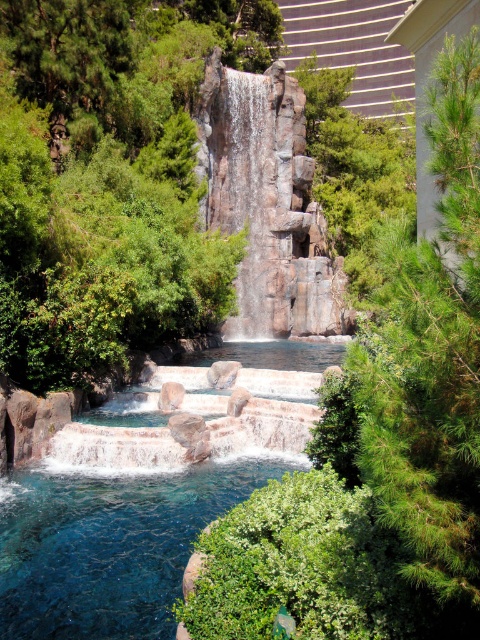
Consider the image. Who is more forward, (477, 228) or (143, 627)?

Point (477, 228) is more forward.

Which of these two, green needle-like at right or clear blue stone pool at center, stands shorter?

clear blue stone pool at center

The width and height of the screenshot is (480, 640). I want to click on green needle-like at right, so click(423, 362).

Image resolution: width=480 pixels, height=640 pixels. What are the coordinates of `green needle-like at right` in the screenshot? It's located at (423, 362).